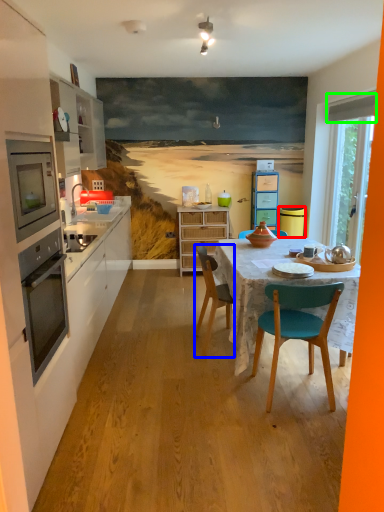
Question: Estimate the real-world distances between objects in this image. Which object is farther from trash bin/can (highlighted by a red box), chair (highlighted by a blue box) or exhaust hood (highlighted by a green box)?

Choices:
 (A) chair
 (B) exhaust hood

Answer: (A)